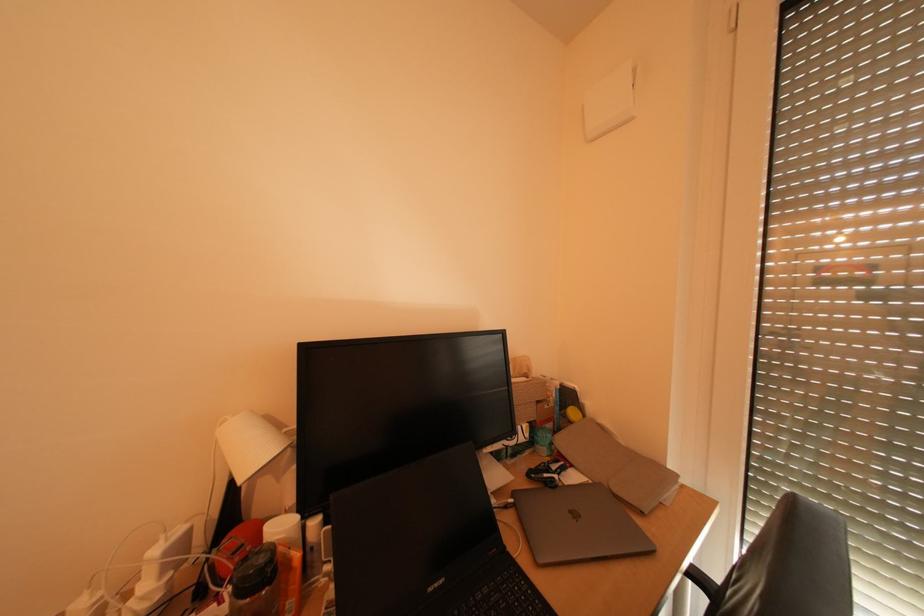
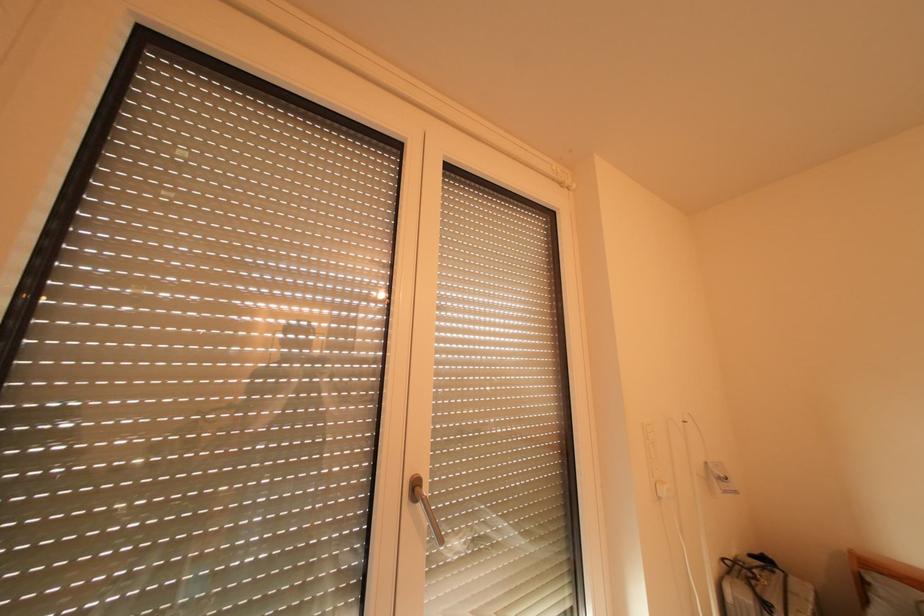
Question: The first image is from the beginning of the video and the second image is from the end. How did the camera likely rotate when shooting the video?

Choices:
 (A) Left
 (B) Right
 (C) Up
 (D) Down

Answer: (B)